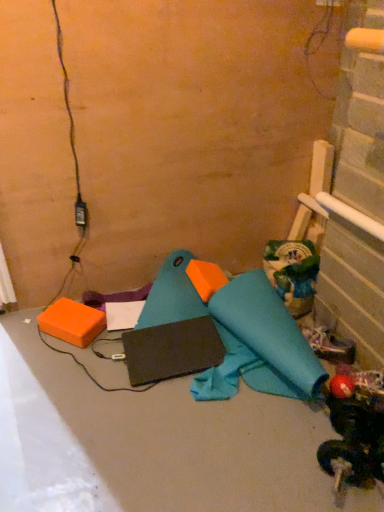
Locate an element on the screen. free spot to the left of orange foam block at lower left is located at coordinates (26, 338).